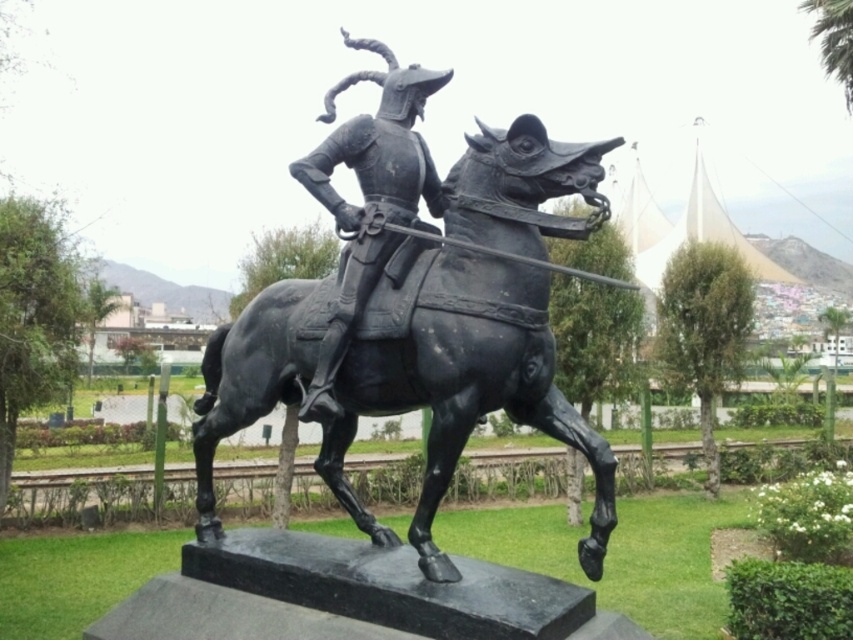
Consider the image. You are a park maintenance worker who needs to place a new bench near the statue. The bench requires a space that is wider than the black polished horse at center and the black polished metal horseman at center. Based on the statue, which part of the statue should you consider for the bench placement?

The black polished horse at center might be wider than the black polished metal horseman at center, so you should consider placing the bench where the black polished horse at center is located to ensure sufficient width.

You are standing in front of the black statue of a knight and horse in the park. There are two points marked on the statue base. One is at coordinates point (271,349) and the other at point (341,152). Which of these points is closer to you?

Point (271,349) is further to the viewer than point (341,152), so the point closer to you is point (341,152).

You are standing in a park and see the black polished horse at center. If you take two steps forward, will you be closer than 3 meters to the horse?

The black polished horse at center is 3.88 meters away from viewer. Taking two steps forward would reduce the distance, but unless each step covers more than 0.94 meters, you would still be over 3 meters away.